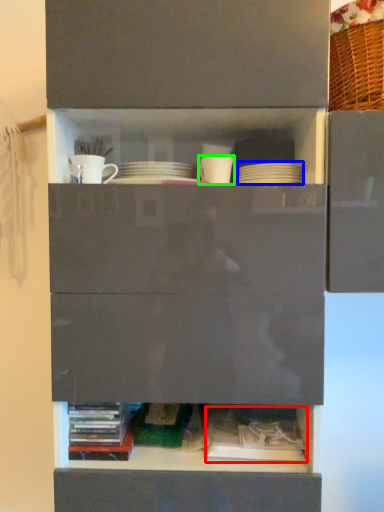
Question: Which object is positioned closest to book (highlighted by a red box)? Select from tableware (highlighted by a blue box) and tableware (highlighted by a green box).

Choices:
 (A) tableware
 (B) tableware

Answer: (A)